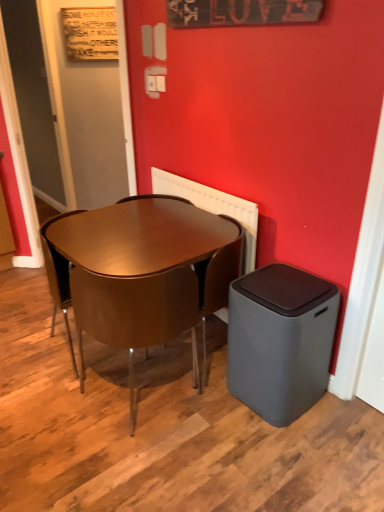
The width and height of the screenshot is (384, 512). I want to click on vacant region to the left of gray matte trash bin at lower right, so click(x=214, y=416).